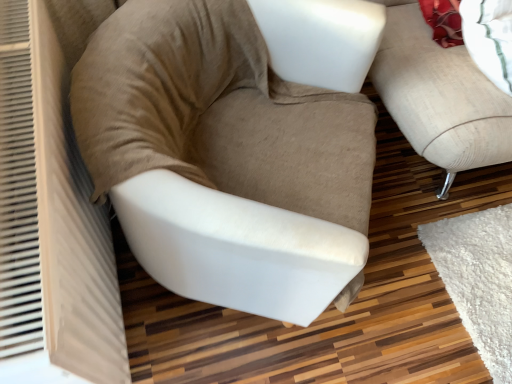
Question: In terms of size, does beige fabric chair at center appear bigger or smaller than beige fabric studio couch at right?

Choices:
 (A) small
 (B) big

Answer: (A)

Question: From their relative heights in the image, would you say beige fabric chair at center is taller or shorter than beige fabric studio couch at right?

Choices:
 (A) short
 (B) tall

Answer: (A)

Question: Do you think beige fabric chair at center is within beige fabric studio couch at right, or outside of it?

Choices:
 (A) outside
 (B) inside

Answer: (A)

Question: From the image's perspective, is beige fabric studio couch at right positioned above or below beige fabric chair at center?

Choices:
 (A) above
 (B) below

Answer: (A)

Question: Considering their positions, is beige fabric studio couch at right located in front of or behind beige fabric chair at center?

Choices:
 (A) front
 (B) behind

Answer: (B)

Question: Is point (481, 160) closer or farther from the camera than point (137, 256)?

Choices:
 (A) closer
 (B) farther

Answer: (B)

Question: Is beige fabric studio couch at right taller or shorter than beige fabric chair at center?

Choices:
 (A) short
 (B) tall

Answer: (B)